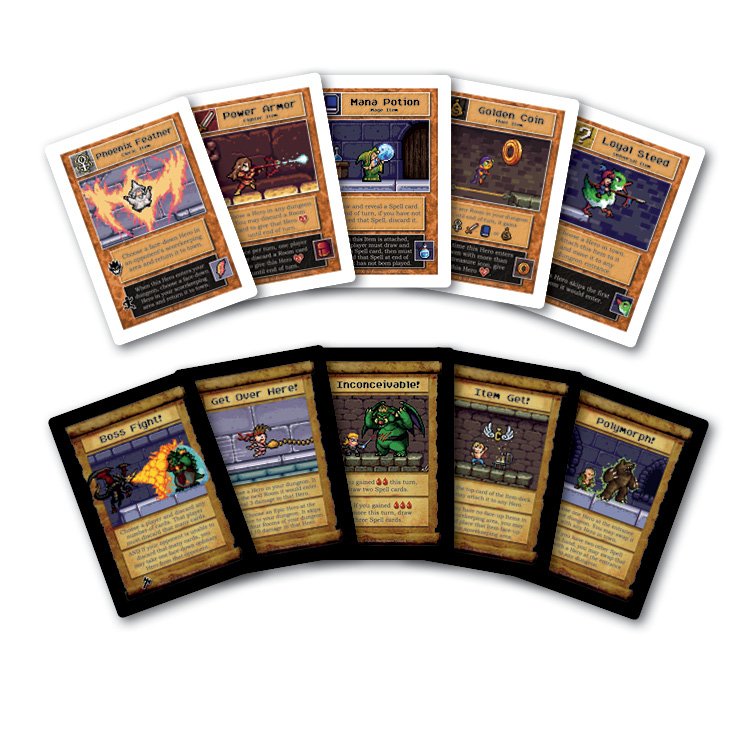
What are the coordinates of `walls in card art` in the screenshot? It's located at (190, 199), (271, 141), (348, 135), (477, 144), (642, 226), (594, 457), (522, 448), (346, 409), (286, 424), (108, 464).